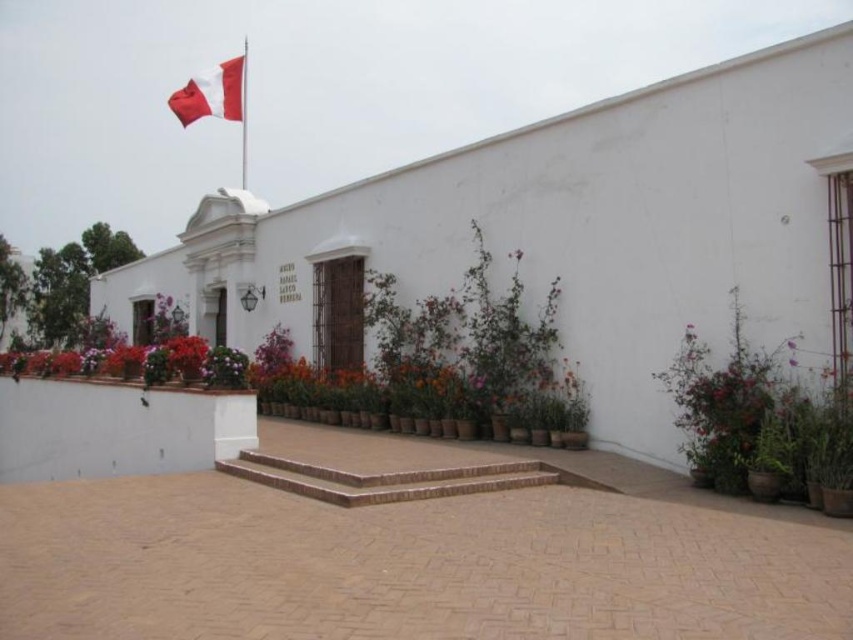
Can you confirm if red/white fabric flag at upper left is taller than metallic flag pole at upper left?

No, red/white fabric flag at upper left is not taller than metallic flag pole at upper left.

Between red/white fabric flag at upper left and metallic flag pole at upper left, which one appears on the left side from the viewer's perspective?

red/white fabric flag at upper left is more to the left.

This screenshot has height=640, width=853. I want to click on red/white fabric flag at upper left, so click(212, 93).

In order to click on red/white fabric flag at upper left in this screenshot , I will do `click(212, 93)`.

Consider the image. Is green leafy plant at right bigger than red/white fabric flag at upper left?

No.

Can you confirm if green leafy plant at right is positioned to the left of red/white fabric flag at upper left?

Incorrect, green leafy plant at right is not on the left side of red/white fabric flag at upper left.

Identify the location of green leafy plant at right. The height and width of the screenshot is (640, 853). (759, 422).

Find the location of a particular element. Image resolution: width=853 pixels, height=640 pixels. green leafy plant at right is located at coordinates (759, 422).

Is green leafy plant at right below metallic flag pole at upper left?

Indeed, green leafy plant at right is positioned under metallic flag pole at upper left.

Which is in front, point (844, 420) or point (242, 157)?

Point (844, 420) is in front.

Locate an element on the screen. The height and width of the screenshot is (640, 853). green leafy plant at right is located at coordinates (759, 422).